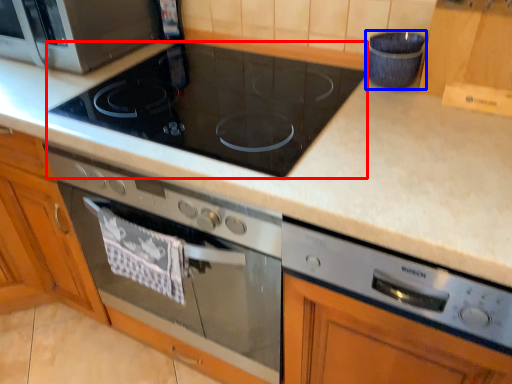
Question: Among these objects, which one is farthest to the camera, gas stove (highlighted by a red box) or appliance (highlighted by a blue box)?

Choices:
 (A) gas stove
 (B) appliance

Answer: (B)